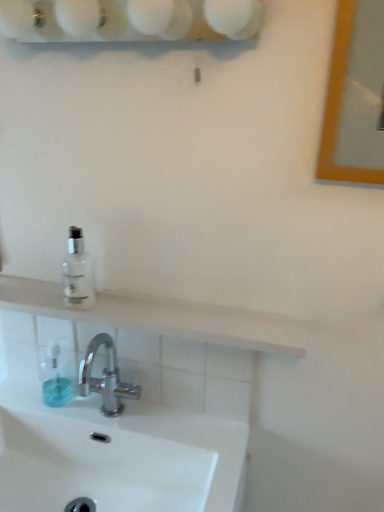
Question: Does transparent glass bottle at upper left turn towards transparent plastic soap dispenser at lower left?

Choices:
 (A) yes
 (B) no

Answer: (B)

Question: Considering the relative sizes of transparent glass bottle at upper left and transparent plastic soap dispenser at lower left in the image provided, is transparent glass bottle at upper left bigger than transparent plastic soap dispenser at lower left?

Choices:
 (A) no
 (B) yes

Answer: (B)

Question: From a real-world perspective, is transparent glass bottle at upper left located beneath transparent plastic soap dispenser at lower left?

Choices:
 (A) yes
 (B) no

Answer: (B)

Question: From a real-world perspective, is transparent glass bottle at upper left positioned over transparent plastic soap dispenser at lower left based on gravity?

Choices:
 (A) no
 (B) yes

Answer: (B)

Question: Can you confirm if transparent glass bottle at upper left is thinner than transparent plastic soap dispenser at lower left?

Choices:
 (A) yes
 (B) no

Answer: (B)

Question: Does transparent glass bottle at upper left have a smaller size compared to transparent plastic soap dispenser at lower left?

Choices:
 (A) no
 (B) yes

Answer: (A)

Question: Is transparent glass bottle at upper left completely or partially inside white glossy sink at lower center?

Choices:
 (A) no
 (B) yes

Answer: (A)

Question: Is white glossy sink at lower center far from transparent glass bottle at upper left?

Choices:
 (A) no
 (B) yes

Answer: (A)

Question: From a real-world perspective, is white glossy sink at lower center located higher than transparent glass bottle at upper left?

Choices:
 (A) yes
 (B) no

Answer: (B)

Question: Is white glossy sink at lower center outside transparent glass bottle at upper left?

Choices:
 (A) no
 (B) yes

Answer: (B)

Question: Does white glossy sink at lower center turn towards transparent glass bottle at upper left?

Choices:
 (A) no
 (B) yes

Answer: (A)

Question: Is white glossy sink at lower center shorter than transparent glass bottle at upper left?

Choices:
 (A) no
 (B) yes

Answer: (B)

Question: Is transparent plastic soap dispenser at lower left bigger than white matte shelf at upper center?

Choices:
 (A) yes
 (B) no

Answer: (B)